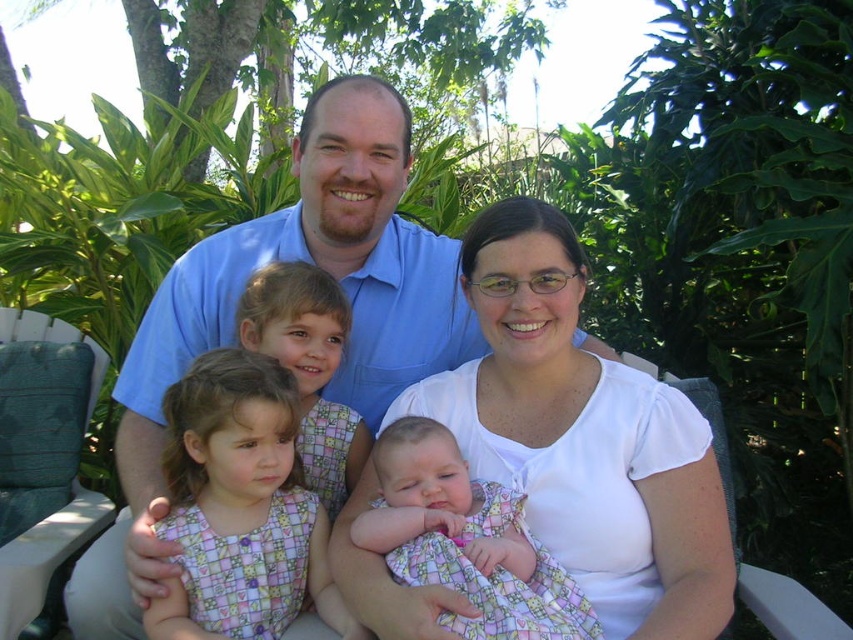
Can you confirm if white cotton shirt at center is smaller than blue cotton shirt at center?

Yes.

Between white cotton shirt at center and blue cotton shirt at center, which one has more height?

Standing taller between the two is blue cotton shirt at center.

What are the coordinates of `white cotton shirt at center` in the screenshot? It's located at (583, 436).

Does blue cotton shirt at center have a lesser width compared to plaid fabric dress at lower left?

No, blue cotton shirt at center is not thinner than plaid fabric dress at lower left.

Is point (399, 300) closer to viewer compared to point (206, 541)?

That is False.

Where is `blue cotton shirt at center`? blue cotton shirt at center is located at coordinates click(x=234, y=326).

Does white cotton shirt at center appear on the left side of floral fabric baby at center?

In fact, white cotton shirt at center is to the right of floral fabric baby at center.

Can you confirm if white cotton shirt at center is bigger than floral fabric baby at center?

Correct, white cotton shirt at center is larger in size than floral fabric baby at center.

Identify the location of white cotton shirt at center. (583, 436).